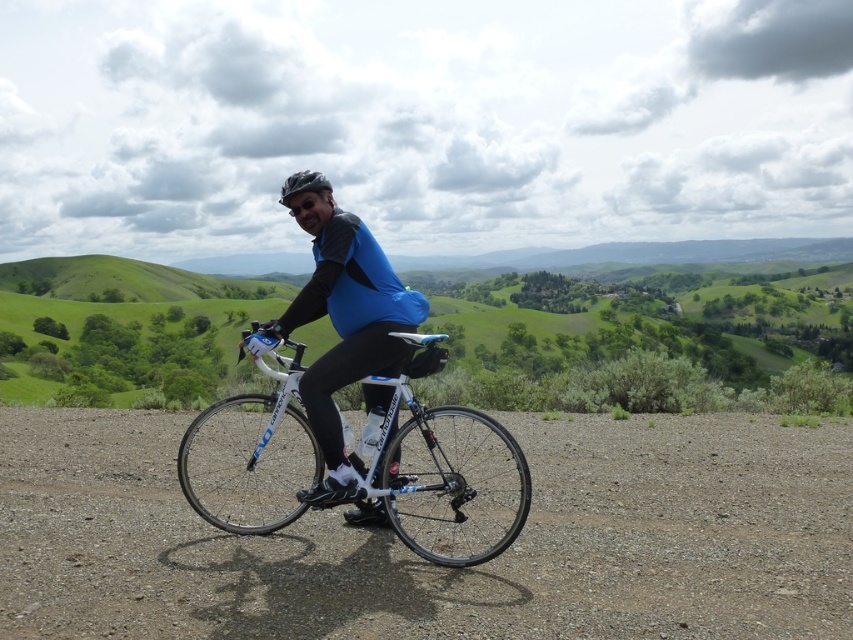
You are the cyclist in the image. You need to reach a destination located at point (375, 314). However, there is an obstacle at point (531, 611). Can you safely navigate around the obstacle to reach your destination?

Point (531, 611) is in front of point (375, 314), so the obstacle is blocking the path to the destination. You will need to find an alternative route to reach your destination.

Looking at this image, you are a cyclist wearing the blue fabric shirt at center and riding on the gray gravel dirt track at center. To stay on the track, should you adjust your direction to the left or right?

The gray gravel dirt track at center is to the right of the blue fabric shirt at center, so to stay on the track, you should adjust your direction to the right.

You are a cyclist planning to ride along the path shown in the image. You notice the green grassy hillside at center and the white glossy bicycle at center. Which object would block your view first as you approach them?

The green grassy hillside at center would block your view first because it is in front of the white glossy bicycle at center.